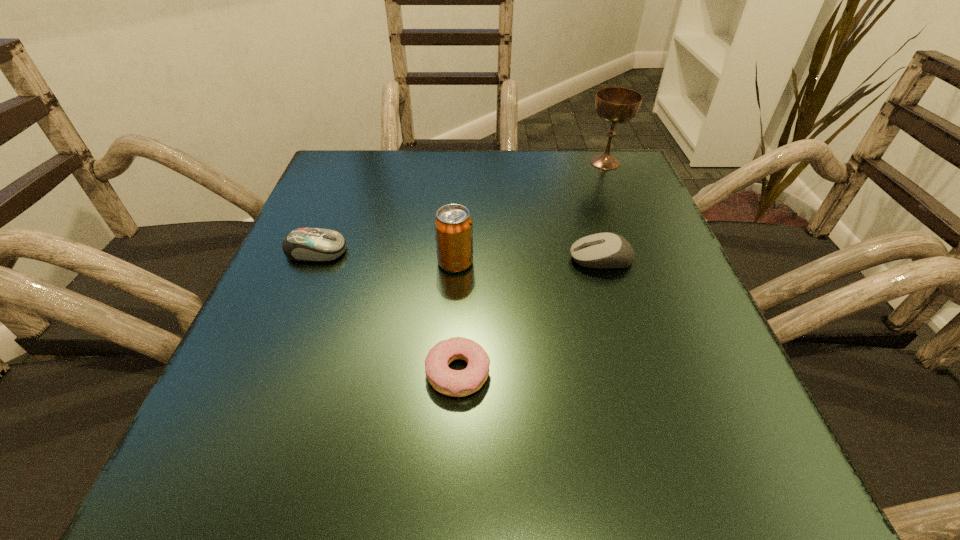
What are the coordinates of `the tallest object` in the screenshot? It's located at (615, 105).

Identify the location of the farthest object. (615, 105).

Where is `soda can`? The width and height of the screenshot is (960, 540). soda can is located at coordinates (453, 224).

This screenshot has height=540, width=960. I want to click on the right computer mouse, so click(602, 250).

Where is `the left computer mouse`? This screenshot has width=960, height=540. the left computer mouse is located at coordinates (303, 244).

Where is `doughnut`? Image resolution: width=960 pixels, height=540 pixels. doughnut is located at coordinates (457, 383).

This screenshot has height=540, width=960. Identify the location of the shortest object. (457, 383).

Locate an element on the screen. Image resolution: width=960 pixels, height=540 pixels. free space located on the front of the chalice is located at coordinates (626, 213).

Find the location of a particular element. The height and width of the screenshot is (540, 960). vacant space located on the left of the soda can is located at coordinates (388, 262).

Locate an element on the screen. vacant space situated 0.160m on the wheel side of the right computer mouse is located at coordinates (483, 259).